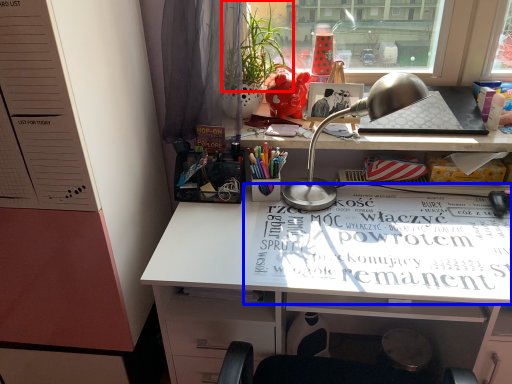
Question: Among these objects, which one is nearest to the camera, plant (highlighted by a red box) or magazine (highlighted by a blue box)?

Choices:
 (A) plant
 (B) magazine

Answer: (B)